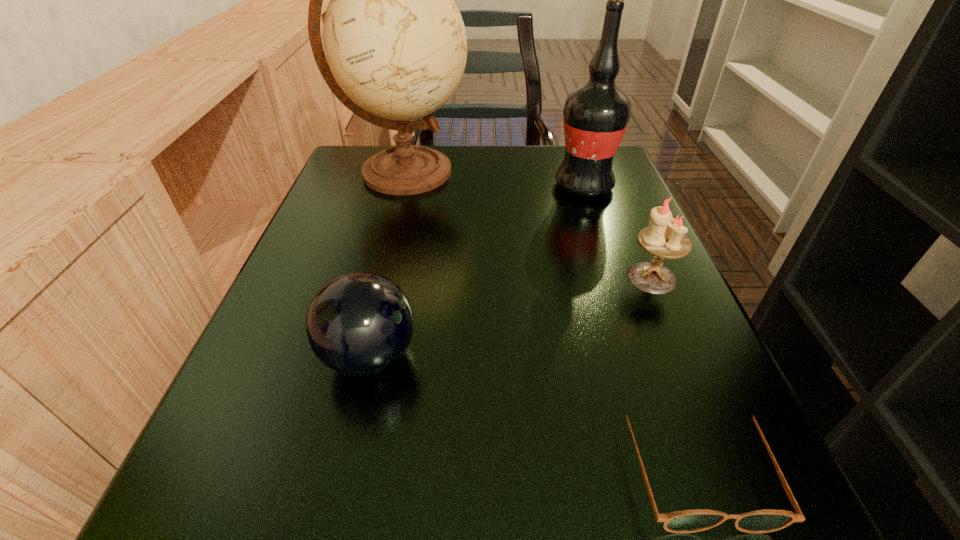
Identify the location of vacant space in between the wine bottle and the globe. The width and height of the screenshot is (960, 540). (494, 179).

Locate an element on the screen. free point between the shortest object and the candle holder is located at coordinates (673, 370).

What are the coordinates of `vacant space that's between the shortest object and the candle holder` in the screenshot? It's located at 673,370.

Locate an element on the screen. The width and height of the screenshot is (960, 540). free space between the globe and the fourth shortest object is located at coordinates (494, 179).

You are a GUI agent. You are given a task and a screenshot of the screen. Output one action in this format:
    pyautogui.click(x=<x>, y=<y>)
    Task: Click on the free spot between the globe and the second tallest object
    This screenshot has height=540, width=960.
    Given the screenshot: What is the action you would take?
    pyautogui.click(x=494, y=179)

Identify the location of empty space that is in between the third nearest object and the fourth farthest object. This screenshot has width=960, height=540. (511, 317).

Where is `free point between the bowling ball and the candle holder`? free point between the bowling ball and the candle holder is located at coordinates (511, 317).

This screenshot has width=960, height=540. I want to click on free space that is in between the globe and the second shortest object, so pos(387,265).

Where is `free point between the fourth shortest object and the candle holder`? Image resolution: width=960 pixels, height=540 pixels. free point between the fourth shortest object and the candle holder is located at coordinates (618, 232).

Identify which object is the third nearest to the fourth farthest object. Please provide its 2D coordinates. Your answer should be formatted as a tuple, i.e. [(x, y)], where the tuple contains the x and y coordinates of a point satisfying the conditions above.

[(664, 238)]